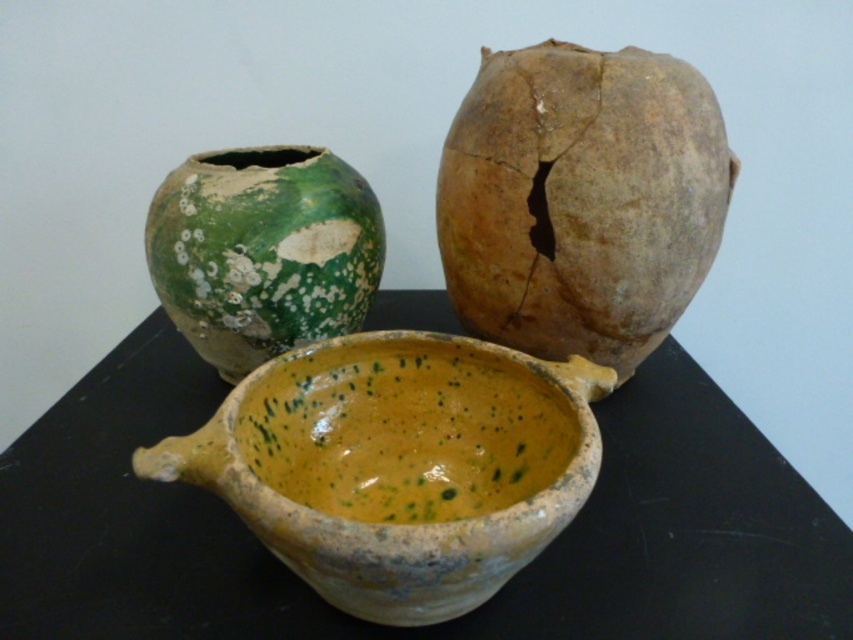
You are an archaeologist examining the image of three ancient vessels. You need to document the exact position of the speckled clay vase at upper right. What are its coordinates in the image?

The speckled clay vase at upper right is located at coordinates (581, 198).

What are the coordinates of the speckled clay soup bowl at center?

The speckled clay soup bowl at center is located at coordinates point (399, 465).